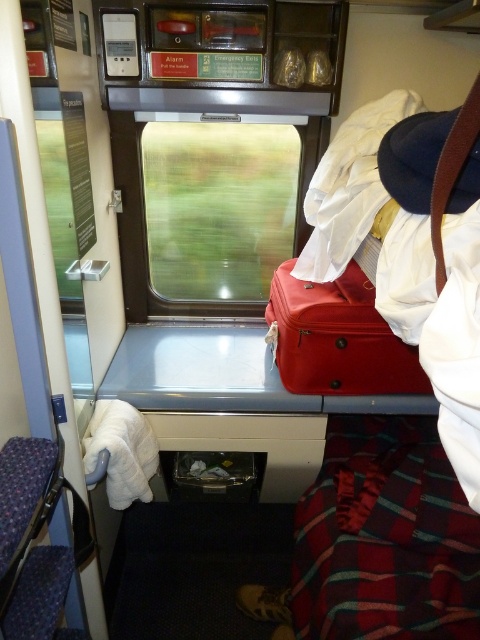
You are a passenger in the train compartment and need to access both the transparent glass window at center and the matte red suitcase at center. Which object would you reach first if you are sitting on the seat directly in front of them?

You would reach the transparent glass window at center first because it is positioned to the left of the matte red suitcase at center, making it closer to your left side if you are facing them.

Consider the image. You are a passenger sitting in the train compartment and want to reach the matte red suitcase at center. However, there is a transparent glass window at center in your way. Can you easily access the suitcase without moving around the window?

The transparent glass window at center is further to the viewer than matte red suitcase at center, meaning the suitcase is closer to you. Therefore, you can easily access the matte red suitcase at center without needing to move around the window.